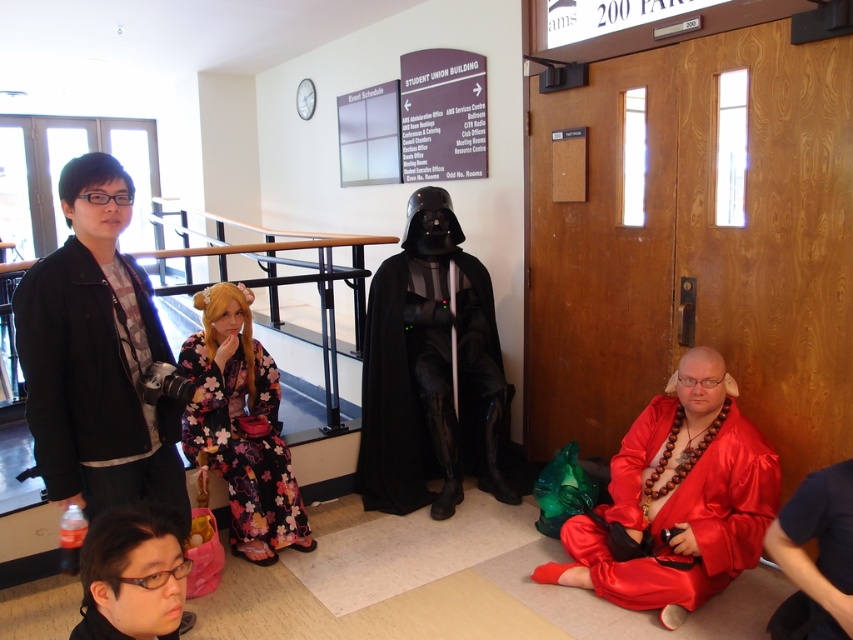
Which is behind, point (445, 257) or point (93, 618)?

Positioned behind is point (445, 257).

Who is positioned more to the left, black matte/soft darth vader costume at center or silky red robe at lower left?

From the viewer's perspective, silky red robe at lower left appears more on the left side.

Is point (440, 292) positioned after point (80, 628)?

That is True.

Find the location of a particular element. black matte/soft darth vader costume at center is located at coordinates (430, 385).

Who is positioned more to the left, floral kimono at center or black matte jacket at left?

black matte jacket at left

Is floral kimono at center shorter than black matte jacket at left?

No.

Is point (254, 508) farther from viewer compared to point (96, 304)?

Yes.

Find the location of `floral kimono at center`. floral kimono at center is located at coordinates (241, 426).

Based on the photo, which of these two, matte black glasses at lower left or silky red robe at lower left, stands taller?

matte black glasses at lower left is taller.

Which is in front, point (102, 531) or point (85, 636)?

Positioned in front is point (85, 636).

Who is more distant from viewer, (122, 572) or (109, 628)?

Positioned behind is point (109, 628).

Identify the location of matte black glasses at lower left. (132, 576).